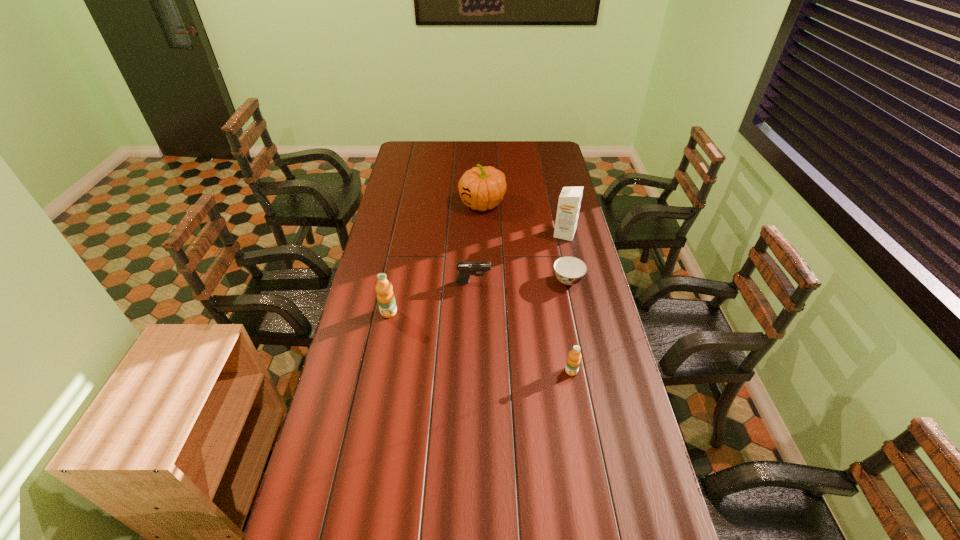
I want to click on vacant space located 0.320m on the left of the second farthest object, so click(x=480, y=234).

I want to click on vacant space positioned 0.310m on the surface of the farthest object, so click(x=394, y=204).

Find the location of a particular element. The width and height of the screenshot is (960, 540). vacant space located 0.350m on the surface of the farthest object is located at coordinates (385, 204).

This screenshot has width=960, height=540. I want to click on free point located 0.080m on the surface of the farthest object, so click(x=442, y=204).

Locate an element on the screen. This screenshot has width=960, height=540. free region located 0.330m at the barrel of the pistol is located at coordinates (576, 282).

This screenshot has height=540, width=960. What are the coordinates of `vacant area located 0.110m on the front of the shortest object` in the screenshot? It's located at (575, 313).

Locate an element on the screen. object at the left edge is located at coordinates (385, 296).

Where is `orange juice that is positioned at the right edge`? The height and width of the screenshot is (540, 960). orange juice that is positioned at the right edge is located at coordinates (573, 361).

I want to click on carton at the right edge, so click(569, 202).

Where is `soup bowl positioned at the right edge`? The height and width of the screenshot is (540, 960). soup bowl positioned at the right edge is located at coordinates (569, 270).